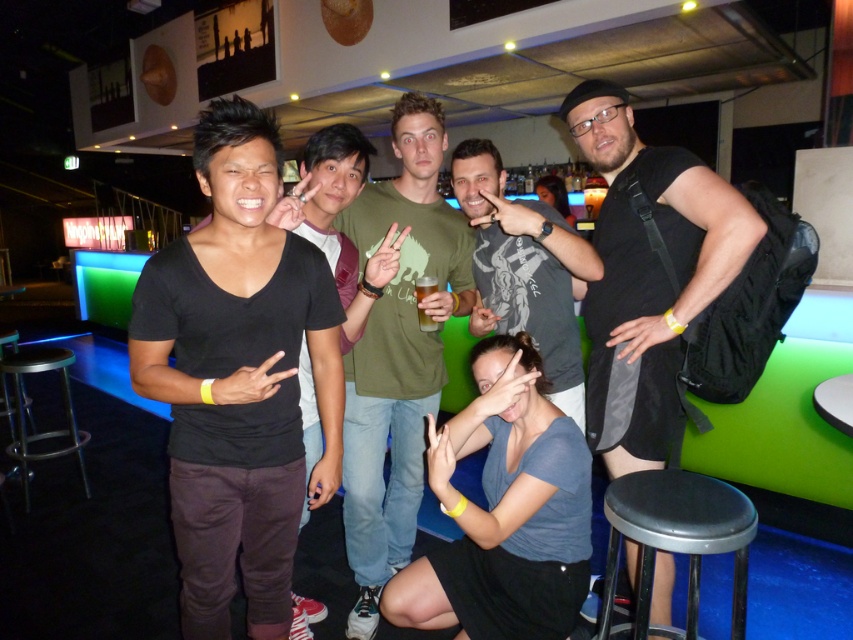
Question: Is black matte backpack at right bigger than green matte shirt at center?

Choices:
 (A) no
 (B) yes

Answer: (A)

Question: Is black matte backpack at right positioned in front of translucent plastic cup at center?

Choices:
 (A) no
 (B) yes

Answer: (B)

Question: Considering the relative positions of black matte backpack at right and metallic silver bar stool at lower left in the image provided, where is black matte backpack at right located with respect to metallic silver bar stool at lower left?

Choices:
 (A) above
 (B) below

Answer: (A)

Question: Which is farther from the black matte bar stool at lower right?

Choices:
 (A) green matte shirt at center
 (B) translucent plastic cup at center
 (C) metallic silver bar stool at lower left
 (D) dark gray t-shirt at center

Answer: (C)

Question: Which point appears closest to the camera in this image?

Choices:
 (A) (653, 580)
 (B) (18, 452)
 (C) (427, 321)

Answer: (A)

Question: Estimate the real-world distances between objects in this image. Which object is farther from the translucent plastic cup at center?

Choices:
 (A) green matte shirt at center
 (B) metallic silver bar stool at lower left
 (C) black matte backpack at right
 (D) black matte bar stool at lower right

Answer: (B)